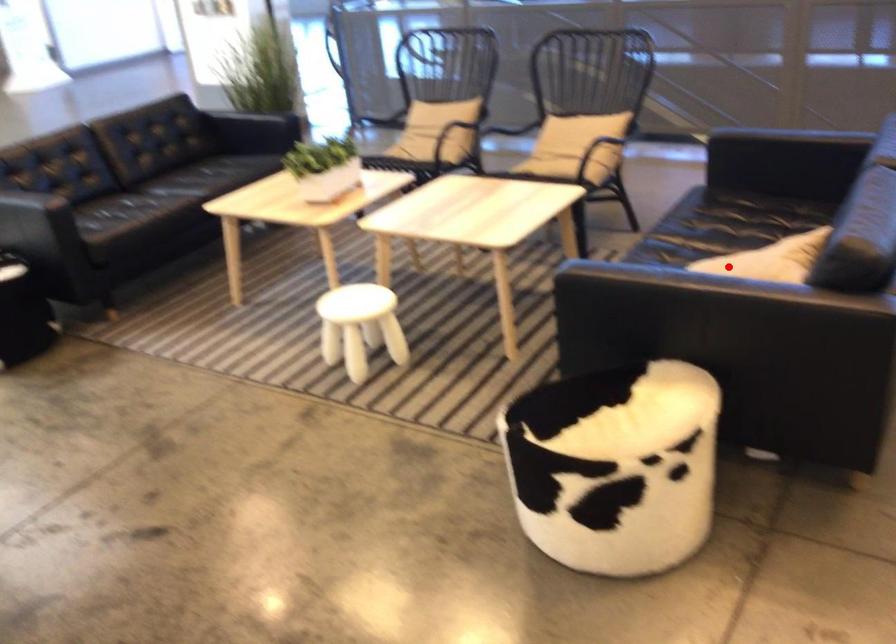
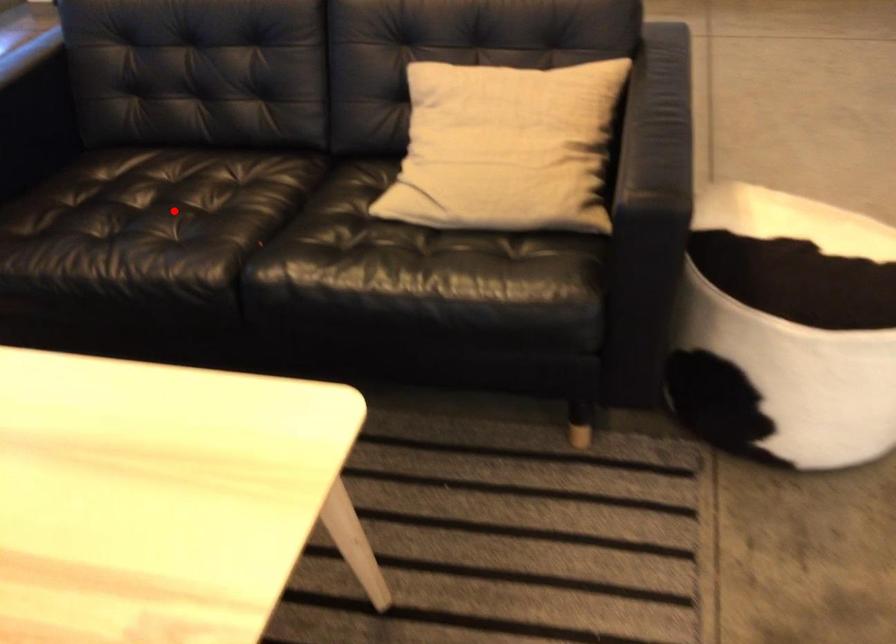
I am providing you with two images of the same scene from different viewpoints. A red point is marked on the first image and another point is marked on the second image. Is the red point in image1 aligned with the point shown in image2?

No